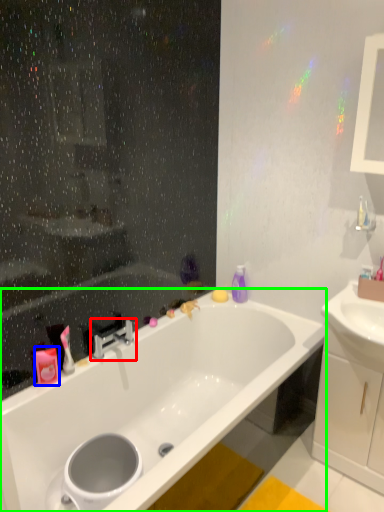
Question: Which object is the closest to the tap (highlighted by a red box)? Choose among these: toiletry (highlighted by a blue box) or bathtub (highlighted by a green box).

Choices:
 (A) toiletry
 (B) bathtub

Answer: (A)